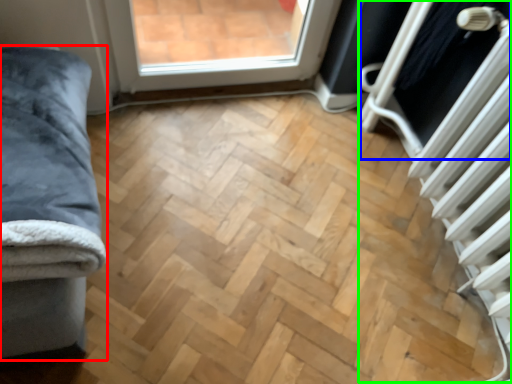
Question: Which object is positioned closest to furniture (highlighted by a red box)? Select from screen door (highlighted by a blue box) and radiator (highlighted by a green box).

Choices:
 (A) screen door
 (B) radiator

Answer: (B)